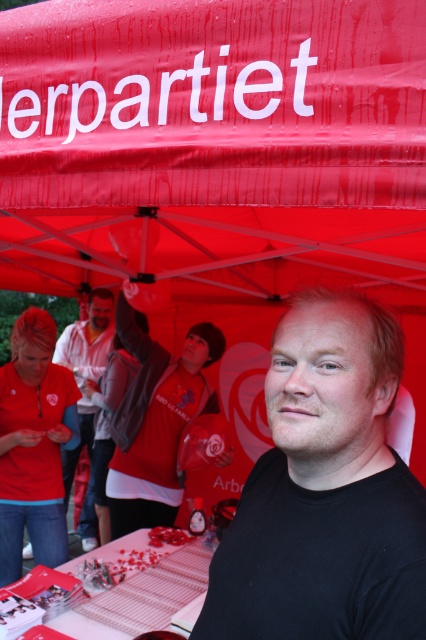
Question: Can you confirm if matte plastic table at center is wider than matte white shirt at center?

Choices:
 (A) yes
 (B) no

Answer: (B)

Question: Considering the real-world distances, which object is closest to the matte white shirt at center?

Choices:
 (A) black matte shirt at center
 (B) matte plastic table at center

Answer: (B)

Question: Is matte plastic table at center behind matte white shirt at center?

Choices:
 (A) yes
 (B) no

Answer: (B)

Question: Which point is farther to the camera?

Choices:
 (A) (138, 580)
 (B) (104, 298)
 (C) (385, 323)

Answer: (B)

Question: Is black matte shirt at center wider than matte plastic table at center?

Choices:
 (A) no
 (B) yes

Answer: (A)

Question: Which object is positioned closest to the black matte shirt at center?

Choices:
 (A) matte white shirt at center
 (B) matte plastic table at center

Answer: (B)